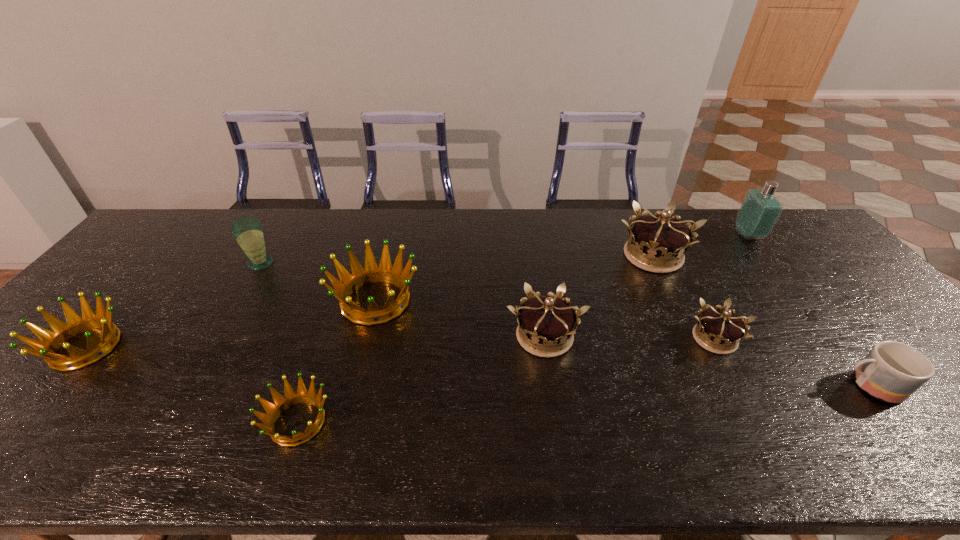
This screenshot has width=960, height=540. I want to click on object present at the left edge, so click(51, 341).

The height and width of the screenshot is (540, 960). In order to click on object that is positioned at the right edge in this screenshot , I will do `click(892, 371)`.

Where is `free point at the far edge`? free point at the far edge is located at coordinates (492, 248).

In the image, there is a desktop. What are the coordinates of `vacant space at the near edge` in the screenshot? It's located at (565, 465).

I want to click on vacant space at the right edge, so click(857, 294).

In the image, there is a desktop. Where is `free region at the far right corner`? Image resolution: width=960 pixels, height=540 pixels. free region at the far right corner is located at coordinates (783, 222).

At what (x,y) coordinates should I click in order to perform the action: click on empty location between the biggest gold crown and the perfume. Please return your answer as a coordinate pair (x, y). The height and width of the screenshot is (540, 960). Looking at the image, I should click on (701, 245).

The image size is (960, 540). What are the coordinates of `vacant point located between the farthest gold crown and the glass` in the screenshot? It's located at (457, 260).

The width and height of the screenshot is (960, 540). What are the coordinates of `free spot between the second smallest golden crown and the second object from left to right` in the screenshot? It's located at (173, 305).

You are a GUI agent. You are given a task and a screenshot of the screen. Output one action in this format:
    pyautogui.click(x=<x>, y=<y>)
    Task: Click on the empty space that is in between the mug and the smallest gold crown
    
    Given the screenshot: What is the action you would take?
    pyautogui.click(x=792, y=362)